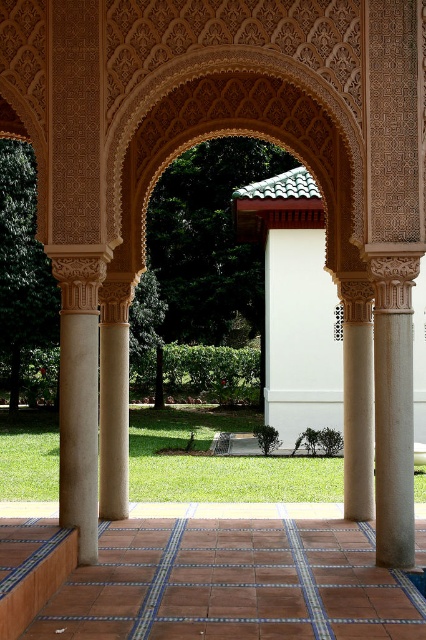
You are an architect designing a new floor plan and want to ensure the terracotta tile floor at center and sandy beige column at left fit within a 10 meter wide space. Given their widths, can both fit side by side?

The terracotta tile floor at center is wider than the sandy beige column at left. However, without specific measurements, it is impossible to determine if both can fit side by side within a 10 meter space.